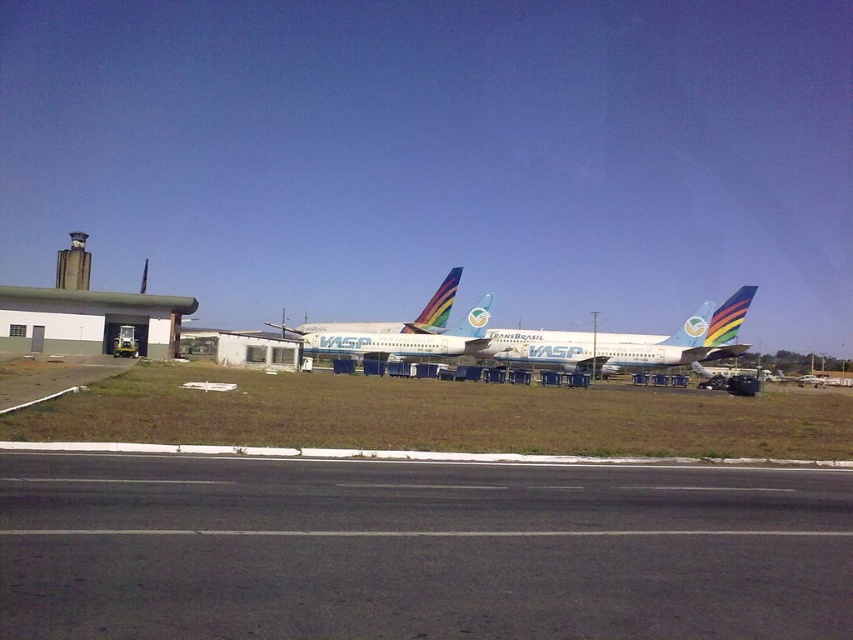
You are an airport maintenance worker and need to park a new small delivery drone. You see the white glossy airliner at center and the white glossy airplane at center. Which one is smaller and better suited for the drone to park next to?

The white glossy airliner at center is smaller compared to the white glossy airplane at center, so it is better suited for the drone to park next to.

You are standing at a point equidistant from both point [25,472] and point [622,369]. Which point would appear larger to you?

Point [25,472] is closer to the camera than point [622,369], so it would appear larger.